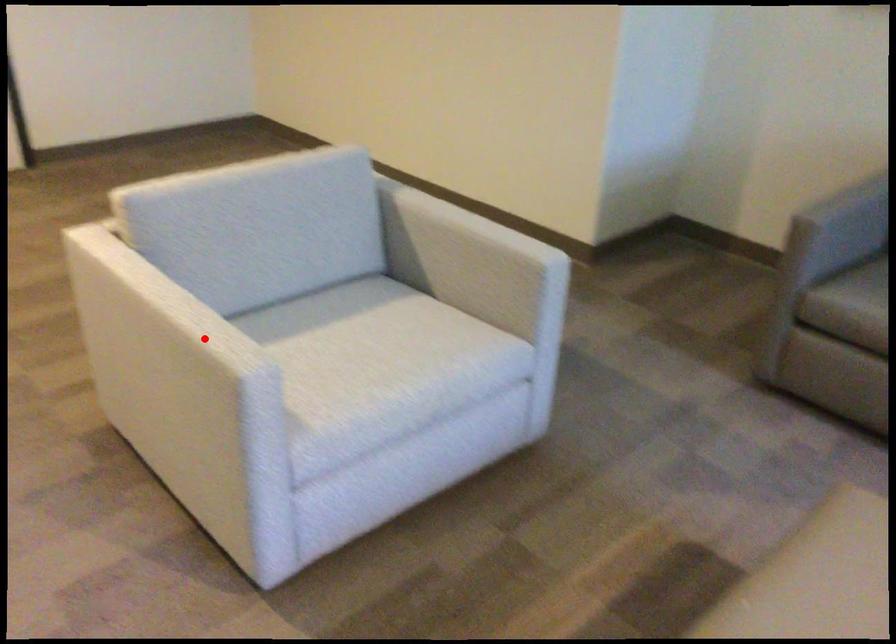
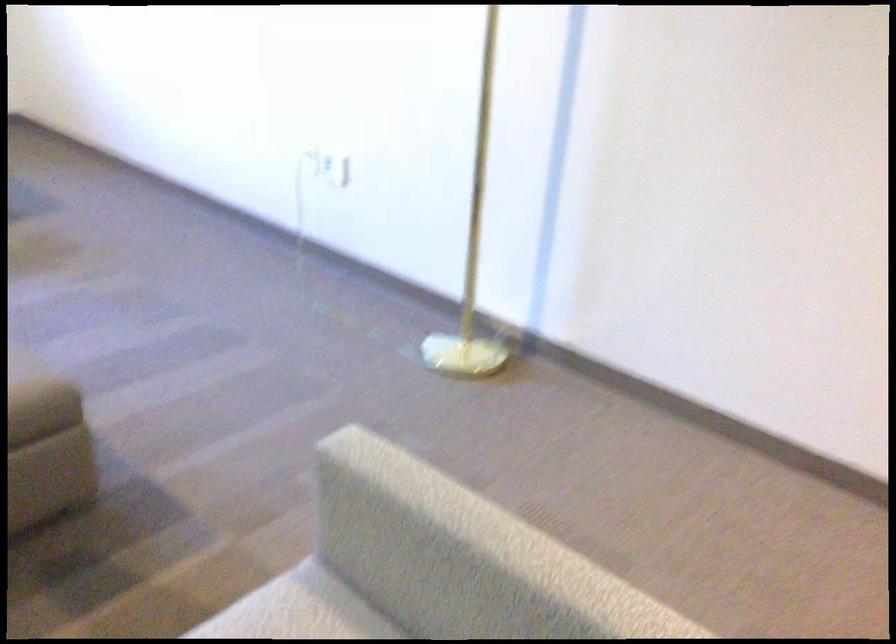
In the second image, find the point that corresponds to the highlighted location in the first image.

(421, 489)